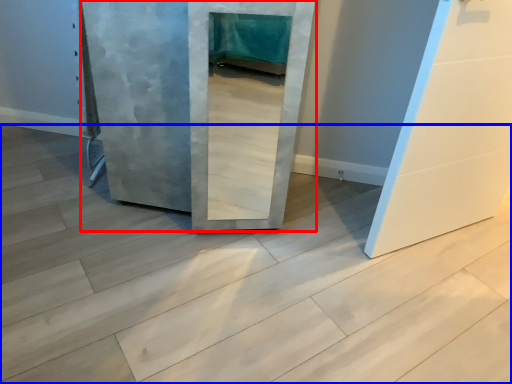
Question: Among these objects, which one is nearest to the camera, door (highlighted by a red box) or concrete (highlighted by a blue box)?

Choices:
 (A) door
 (B) concrete

Answer: (B)